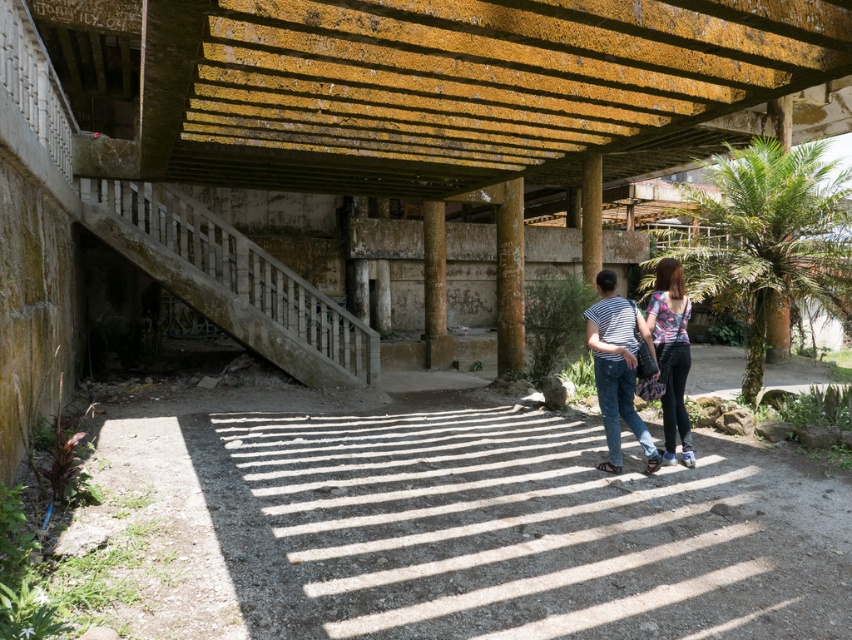
Question: Which point is farther from the camera taking this photo?

Choices:
 (A) (659, 353)
 (B) (625, 419)

Answer: (B)

Question: Which is farther from the floral fabric top at center?

Choices:
 (A) concrete/stained stairs at lower left
 (B) striped cotton shirt at center
 (C) gray gravel path at center

Answer: (A)

Question: Can you confirm if gray gravel path at center is smaller than floral fabric top at center?

Choices:
 (A) yes
 (B) no

Answer: (A)

Question: Which is farther from the floral fabric top at center?

Choices:
 (A) striped cotton shirt at center
 (B) gray gravel path at center
 (C) concrete/stained stairs at lower left

Answer: (C)

Question: Is concrete/stained stairs at lower left wider than striped cotton shirt at center?

Choices:
 (A) yes
 (B) no

Answer: (A)

Question: Is the position of gray gravel path at center more distant than that of concrete/stained stairs at lower left?

Choices:
 (A) no
 (B) yes

Answer: (A)